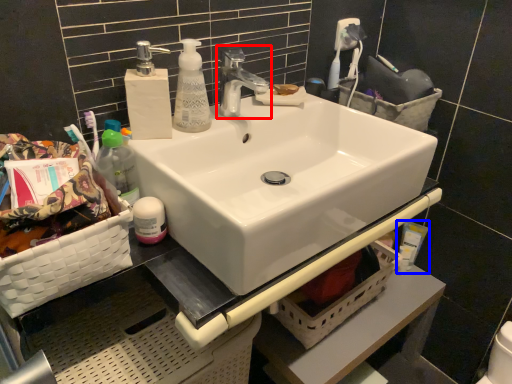
Question: Which object is closer to the camera taking this photo, tap (highlighted by a red box) or toiletry (highlighted by a blue box)?

Choices:
 (A) tap
 (B) toiletry

Answer: (A)